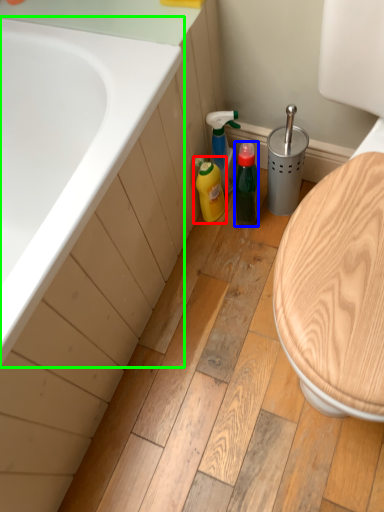
Question: Which object is positioned farthest from cleaning product (highlighted by a red box)? Select from bottle (highlighted by a blue box) and bathtub (highlighted by a green box).

Choices:
 (A) bottle
 (B) bathtub

Answer: (B)